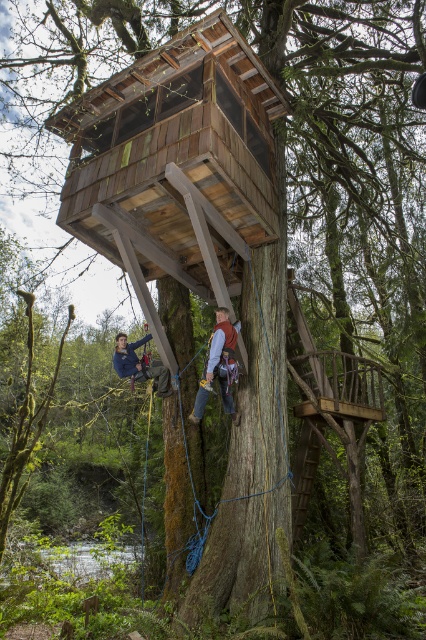
Question: Can you confirm if brown leather harness at center is positioned below blue denim jacket at center?

Choices:
 (A) no
 (B) yes

Answer: (B)

Question: Does brown leather harness at center have a larger size compared to blue denim jacket at center?

Choices:
 (A) yes
 (B) no

Answer: (A)

Question: Observing the image, what is the correct spatial positioning of brown leather harness at center in reference to blue denim jacket at center?

Choices:
 (A) left
 (B) right

Answer: (B)

Question: Which of the following is the farthest from the observer?

Choices:
 (A) brown leather harness at center
 (B) blue denim jacket at center

Answer: (B)

Question: Which of the following is the farthest from the observer?

Choices:
 (A) blue denim jacket at center
 (B) brown leather harness at center

Answer: (A)